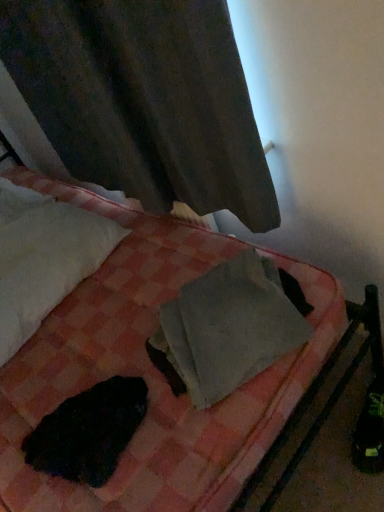
Question: Are black fur at lower left and matte gray curtain at upper left making contact?

Choices:
 (A) no
 (B) yes

Answer: (A)

Question: Can you confirm if black fur at lower left is smaller than matte gray curtain at upper left?

Choices:
 (A) no
 (B) yes

Answer: (B)

Question: From a real-world perspective, is black fur at lower left on top of matte gray curtain at upper left?

Choices:
 (A) no
 (B) yes

Answer: (A)

Question: Is black fur at lower left facing away from matte gray curtain at upper left?

Choices:
 (A) no
 (B) yes

Answer: (A)

Question: Is black fur at lower left thinner than matte gray curtain at upper left?

Choices:
 (A) no
 (B) yes

Answer: (A)

Question: Is matte gray curtain at upper left completely or partially inside black fur at lower left?

Choices:
 (A) no
 (B) yes

Answer: (A)

Question: Is pink checkered blanket at center to the left of white soft pillow at upper left from the viewer's perspective?

Choices:
 (A) no
 (B) yes

Answer: (A)

Question: From the image's perspective, is pink checkered blanket at center located above white soft pillow at upper left?

Choices:
 (A) yes
 (B) no

Answer: (B)

Question: From the image's perspective, is pink checkered blanket at center beneath white soft pillow at upper left?

Choices:
 (A) yes
 (B) no

Answer: (A)

Question: Does pink checkered blanket at center have a larger size compared to white soft pillow at upper left?

Choices:
 (A) no
 (B) yes

Answer: (B)

Question: Is pink checkered blanket at center wider than white soft pillow at upper left?

Choices:
 (A) yes
 (B) no

Answer: (A)

Question: From a real-world perspective, is pink checkered blanket at center on top of white soft pillow at upper left?

Choices:
 (A) yes
 (B) no

Answer: (B)

Question: Is matte gray curtain at upper left facing towards gray matte paper at center?

Choices:
 (A) no
 (B) yes

Answer: (B)